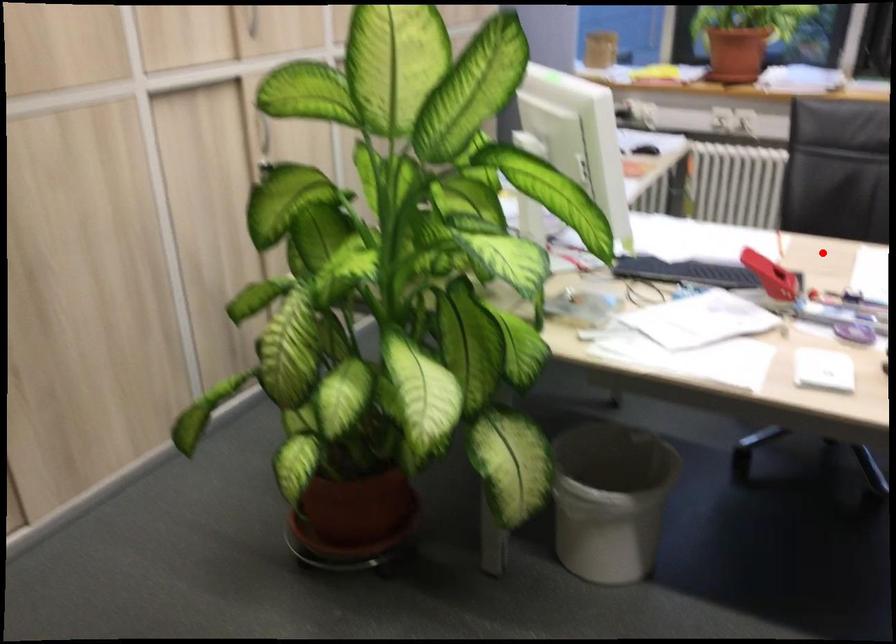
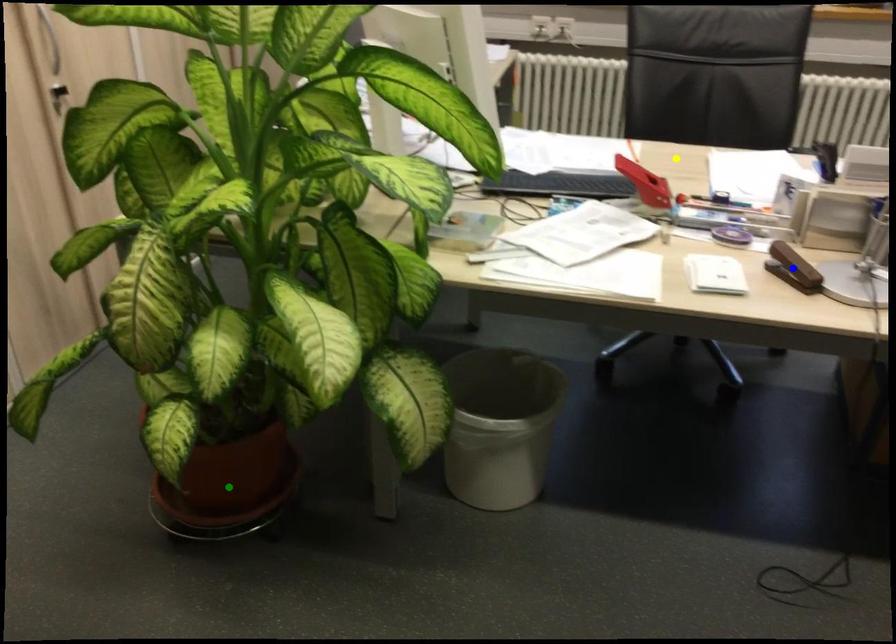
Question: I am providing you with two images of the same scene from different viewpoints. A red point is marked on the first image. You are given multiple points on the second image. Which spot in image 2 lines up with the point in image 1?

Choices:
 (A) blue point
 (B) green point
 (C) yellow point

Answer: (C)